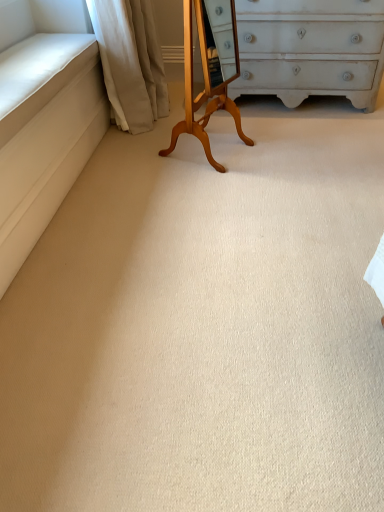
Question: Does light brown wood changing table at center have a lesser height compared to beige fabric curtain at upper left?

Choices:
 (A) yes
 (B) no

Answer: (B)

Question: Is beige fabric curtain at upper left completely or partially inside light brown wood changing table at center?

Choices:
 (A) yes
 (B) no

Answer: (B)

Question: From a real-world perspective, is light brown wood changing table at center over beige fabric curtain at upper left?

Choices:
 (A) yes
 (B) no

Answer: (A)

Question: Is light brown wood changing table at center in contact with beige fabric curtain at upper left?

Choices:
 (A) no
 (B) yes

Answer: (A)

Question: Considering the relative sizes of light brown wood changing table at center and beige fabric curtain at upper left in the image provided, is light brown wood changing table at center smaller than beige fabric curtain at upper left?

Choices:
 (A) yes
 (B) no

Answer: (A)

Question: Considering the relative sizes of light brown wood changing table at center and beige fabric curtain at upper left in the image provided, is light brown wood changing table at center wider than beige fabric curtain at upper left?

Choices:
 (A) no
 (B) yes

Answer: (A)

Question: Would you say beige fabric curtain at upper left contains light brown wood changing table at center?

Choices:
 (A) yes
 (B) no

Answer: (B)

Question: Is beige fabric curtain at upper left bigger than light brown wood changing table at center?

Choices:
 (A) no
 (B) yes

Answer: (B)

Question: Is beige fabric curtain at upper left positioned beyond the bounds of light brown wood changing table at center?

Choices:
 (A) no
 (B) yes

Answer: (B)

Question: From the image's perspective, is beige fabric curtain at upper left above light brown wood changing table at center?

Choices:
 (A) yes
 (B) no

Answer: (A)

Question: From the image's perspective, would you say beige fabric curtain at upper left is shown under light brown wood changing table at center?

Choices:
 (A) yes
 (B) no

Answer: (B)

Question: Is beige fabric curtain at upper left far away from light brown wood changing table at center?

Choices:
 (A) yes
 (B) no

Answer: (B)

Question: Relative to light brown wood changing table at center, is beige fabric curtain at upper left in front or behind?

Choices:
 (A) front
 (B) behind

Answer: (B)